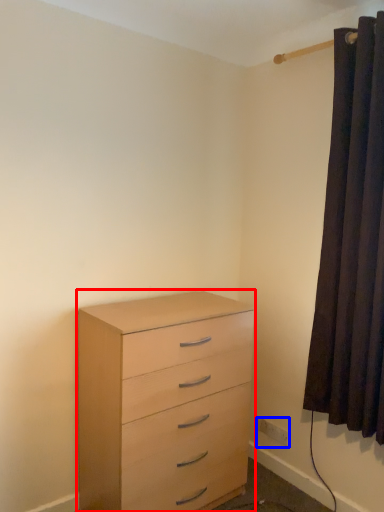
Question: Which of the following is the farthest to the observer, chest of drawers (highlighted by a red box) or electric outlet (highlighted by a blue box)?

Choices:
 (A) chest of drawers
 (B) electric outlet

Answer: (B)